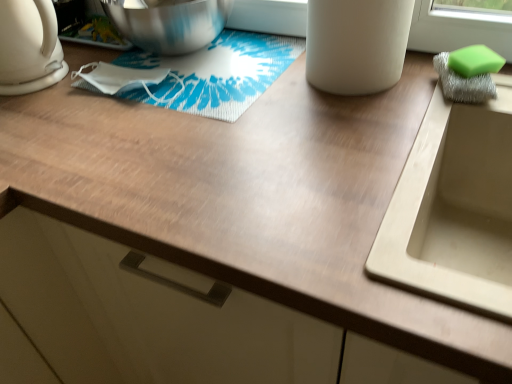
This screenshot has height=384, width=512. I want to click on free location in front of white glossy kettle at left, so click(x=40, y=121).